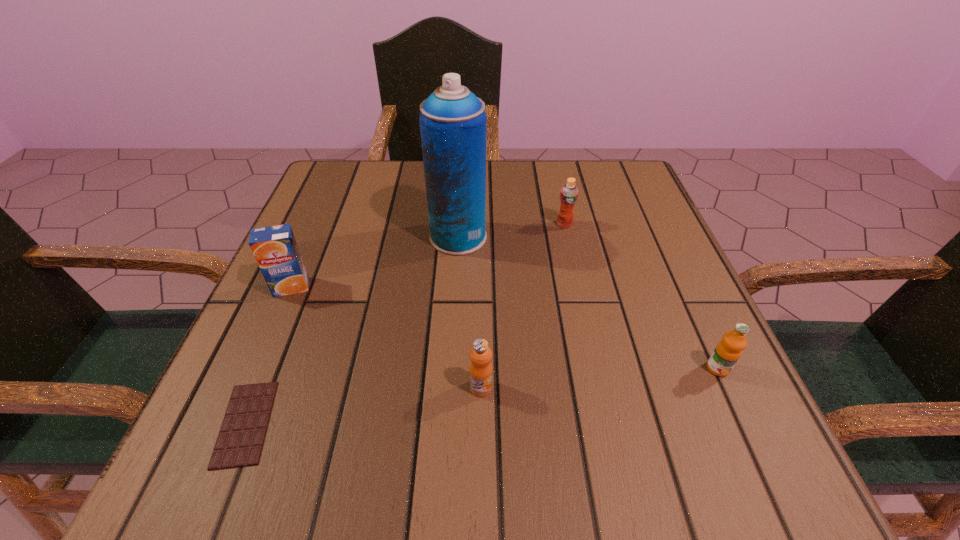
Image resolution: width=960 pixels, height=540 pixels. Find the location of `free space that satisfies the following two spatial constraints: 1. on the front side of the shortest object; 2. on the right side of the third nearest orange juice`. free space that satisfies the following two spatial constraints: 1. on the front side of the shortest object; 2. on the right side of the third nearest orange juice is located at coordinates (232, 423).